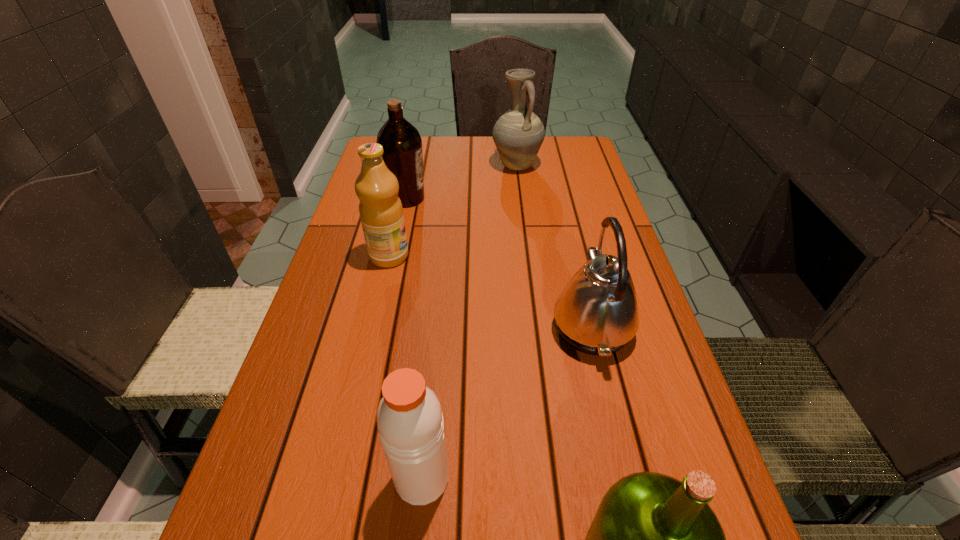
You are a GUI agent. You are given a task and a screenshot of the screen. Output one action in this format:
    pyautogui.click(x=<x>, y=<y>)
    Task: Click on the vacant position located 0.130m from the spout of the kettle
    
    Given the screenshot: What is the action you would take?
    pyautogui.click(x=490, y=327)

At what (x,y) coordinates should I click in order to perform the action: click on free spot located 0.250m from the spout of the kettle. Please return your answer as a coordinate pair (x, y). Looking at the image, I should click on (432, 327).

Find the location of a particular element. free spot located on the left of the third object from left to right is located at coordinates (275, 478).

Identify the location of object at the far edge. This screenshot has width=960, height=540. (518, 134).

Locate an element on the screen. The height and width of the screenshot is (540, 960). object present at the right edge is located at coordinates (x=596, y=313).

Where is `free space at the left edge`? The height and width of the screenshot is (540, 960). free space at the left edge is located at coordinates (342, 273).

Identify the location of free space at the right edge of the desktop. The height and width of the screenshot is (540, 960). (673, 407).

Locate an element on the screen. The image size is (960, 540). vacant area at the far right corner of the desktop is located at coordinates (550, 144).

Locate an element on the screen. The width and height of the screenshot is (960, 540). free space between the fourth object from right to left and the farthest olive oil is located at coordinates (414, 338).

This screenshot has height=540, width=960. Find the location of `vacant region between the third farthest object and the farthest object`. vacant region between the third farthest object and the farthest object is located at coordinates (453, 211).